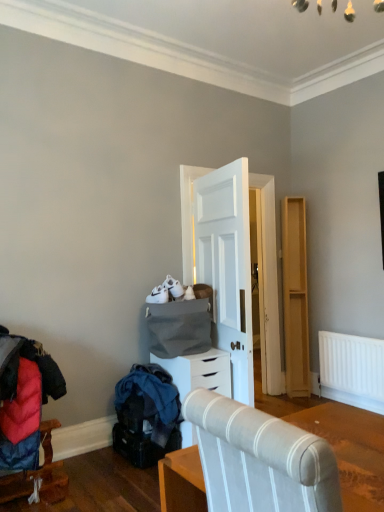
I want to click on free space underneath light wood dresser at right (from a real-world perspective), so click(292, 395).